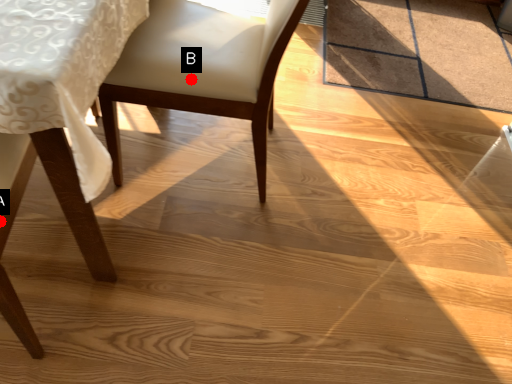
Question: Two points are circled on the image, labeled by A and B beside each circle. Which point is closer to the camera?

Choices:
 (A) A is closer
 (B) B is closer

Answer: (A)